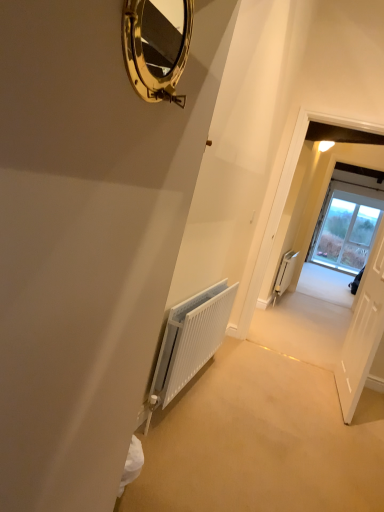
Measure the distance between gold polished mirror at upper center and camera.

A distance of 1.52 meters exists between gold polished mirror at upper center and camera.

Looking at this image, what is the approximate width of white glossy door at center?

The width of white glossy door at center is 5.23 inches.

What are the coordinates of `gold polished mirror at upper center` in the screenshot? It's located at (157, 46).

Which of these two, gold polished mirror at upper center or white matte radiator at right, which appears as the 2th radiator when viewed from the front, is wider?

Wider between the two is white matte radiator at right, which appears as the 2th radiator when viewed from the front.

In the scene shown: From a real-world perspective, which object stands above the other?

In real-world perspective, gold polished mirror at upper center is above.

Locate an element on the screen. This screenshot has width=384, height=512. mirror to the left of white matte radiator at right, which appears as the 2th radiator when viewed from the front is located at coordinates (157, 46).

Could you tell me if gold polished mirror at upper center is turned towards white matte radiator at right, positioned as the second radiator in left-to-right order?

No.

Is white matte radiator at right, the first radiator from the right, at the back of white textured radiator at center, which is the first radiator from front to back?

No.

Considering the sizes of objects white textured radiator at center, placed as the 2th radiator when sorted from back to front, and white matte radiator at right, which appears as the 2th radiator when viewed from the front, in the image provided, who is shorter, white textured radiator at center, placed as the 2th radiator when sorted from back to front, or white matte radiator at right, which appears as the 2th radiator when viewed from the front,?

With less height is white matte radiator at right, which appears as the 2th radiator when viewed from the front.

Based on the photo, is the position of gold polished mirror at upper center less distant than that of white glossy door at center?

Yes, it is.

Which of these two, gold polished mirror at upper center or white glossy door at center, is thinner?

With smaller width is gold polished mirror at upper center.

Is gold polished mirror at upper center aimed at white glossy door at center?

No, gold polished mirror at upper center is not oriented towards white glossy door at center.

How distant is gold polished mirror at upper center from white glossy door at center?

The distance of gold polished mirror at upper center from white glossy door at center is 1.85 meters.

In the image, is white wooden door at right on the left side or the right side of white matte radiator at right, which ranks as the 1th radiator in back-to-front order?

Clearly, white wooden door at right is on the left of white matte radiator at right, which ranks as the 1th radiator in back-to-front order, in the image.

Which is in front, point (347, 341) or point (286, 270)?

The point (347, 341) is closer.

From a real-world perspective, which is physically above, white wooden door at right or white matte radiator at right, which appears as the 2th radiator when viewed from the front?

From a 3D spatial view, white wooden door at right is above.

Locate an element on the screen. radiator located on the right of white wooden door at right is located at coordinates (284, 273).

Is white matte radiator at right, the first radiator from the right, positioned in front of white wooden door at right?

No, it is not.

Where is `door located in front of the white matte radiator at right, positioned as the second radiator in left-to-right order`? Image resolution: width=384 pixels, height=512 pixels. door located in front of the white matte radiator at right, positioned as the second radiator in left-to-right order is located at coordinates (362, 332).

From the image's perspective, does white matte radiator at right, which appears as the 2th radiator when viewed from the front, appear higher than white wooden door at right?

Indeed, from the image's perspective, white matte radiator at right, which appears as the 2th radiator when viewed from the front, is shown above white wooden door at right.

From a real-world perspective, between white matte radiator at right, which appears as the 2th radiator when viewed from the front, and white wooden door at right, who is vertically lower?

white matte radiator at right, which appears as the 2th radiator when viewed from the front, from a real-world perspective.

Does point (346, 350) lie behind point (195, 358)?

Yes, it is behind point (195, 358).

Can you confirm if white wooden door at right is positioned to the left of white textured radiator at center, the first radiator from the left?

No.

Considering the relative sizes of white wooden door at right and white textured radiator at center, placed as the second radiator when sorted from right to left, in the image provided, is white wooden door at right wider than white textured radiator at center, placed as the second radiator when sorted from right to left,?

No.

From the image's perspective, which is above, white wooden door at right or white textured radiator at center, which is the first radiator from front to back?

white wooden door at right appears higher in the image.

Considering the sizes of white glossy door at center and white wooden door at right in the image, is white glossy door at center taller or shorter than white wooden door at right?

In the image, white glossy door at center appears to be taller than white wooden door at right.

Can white wooden door at right be found inside white glossy door at center?

No, white wooden door at right is not a part of white glossy door at center.

Which object is closer to the camera taking this photo, white glossy door at center or white wooden door at right?

Positioned in front is white wooden door at right.

Which point is more forward, (361, 125) or (364, 327)?

The point (364, 327) is more forward.

At what (x,y) coordinates should I click in order to perform the action: click on radiator that is the 2nd object directly below the gold polished mirror at upper center (from a real-world perspective). Please return your answer as a coordinate pair (x, y). Looking at the image, I should click on (284, 273).

You are a GUI agent. You are given a task and a screenshot of the screen. Output one action in this format:
    pyautogui.click(x=<x>, y=<y>)
    Task: Click on the radiator in front of the white matte radiator at right, positioned as the second radiator in left-to-right order
    
    Given the screenshot: What is the action you would take?
    pyautogui.click(x=192, y=338)

Based on the photo, estimate the real-world distances between objects in this image. Which object is further from white matte radiator at right, positioned as the second radiator in left-to-right order, white textured radiator at center, the first radiator from the left, or white wooden door at right?

Based on the image, white textured radiator at center, the first radiator from the left, appears to be further to white matte radiator at right, positioned as the second radiator in left-to-right order.

Based on the photo, looking at the image, which one is located further to white wooden door at right, white textured radiator at center, the first radiator from the left, or white matte radiator at right, positioned as the second radiator in left-to-right order?

white matte radiator at right, positioned as the second radiator in left-to-right order, is positioned further to the anchor white wooden door at right.

Based on their spatial positions, is white textured radiator at center, the first radiator from the left, or white wooden door at right further from gold polished mirror at upper center?

white wooden door at right.

When comparing their distances from white glossy door at center, does gold polished mirror at upper center or white wooden door at right seem closer?

The object closer to white glossy door at center is white wooden door at right.

Estimate the real-world distances between objects in this image. Which object is further from white matte radiator at right, positioned as the second radiator in left-to-right order, white textured radiator at center, which is the first radiator from front to back, or white glossy door at center?

Among the two, white textured radiator at center, which is the first radiator from front to back, is located further to white matte radiator at right, positioned as the second radiator in left-to-right order.

Considering their positions, is white wooden door at right positioned closer to gold polished mirror at upper center than white glossy door at center?

The object closer to gold polished mirror at upper center is white glossy door at center.

Looking at the image, which one is located further to gold polished mirror at upper center, white matte radiator at right, positioned as the second radiator in left-to-right order, or white wooden door at right?

The object further to gold polished mirror at upper center is white matte radiator at right, positioned as the second radiator in left-to-right order.

When comparing their distances from white glossy door at center, does white wooden door at right or gold polished mirror at upper center seem closer?

white wooden door at right lies closer to white glossy door at center than the other object.

The image size is (384, 512). What are the coordinates of `corridor between white textured radiator at center, placed as the 2th radiator when sorted from back to front, and white matte radiator at right, the first radiator from the right, along the z-axis` in the screenshot? It's located at (285, 202).

Find the location of `radiator between gold polished mirror at upper center and white glossy door at center from front to back`. radiator between gold polished mirror at upper center and white glossy door at center from front to back is located at coordinates (192, 338).

Find the location of `radiator located between gold polished mirror at upper center and white matte radiator at right, positioned as the second radiator in left-to-right order, in the depth direction`. radiator located between gold polished mirror at upper center and white matte radiator at right, positioned as the second radiator in left-to-right order, in the depth direction is located at coordinates (192, 338).

In order to click on door between gold polished mirror at upper center and white matte radiator at right, the first radiator from the right, in the front-back direction in this screenshot , I will do `click(362, 332)`.